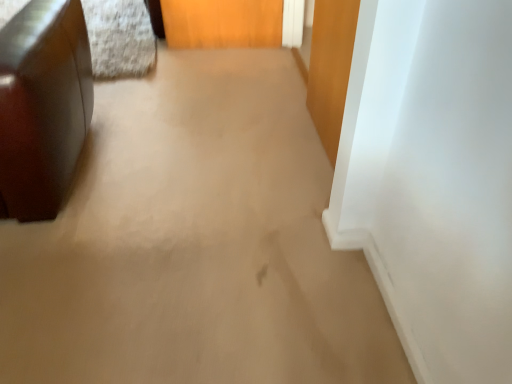
Question: Would you consider glossy brown ottoman at left to be distant from wooden door at upper right?

Choices:
 (A) no
 (B) yes

Answer: (B)

Question: From a real-world perspective, is glossy brown ottoman at left located higher than wooden door at upper right?

Choices:
 (A) yes
 (B) no

Answer: (A)

Question: Is glossy brown ottoman at left positioned in front of wooden door at upper right?

Choices:
 (A) yes
 (B) no

Answer: (A)

Question: Is glossy brown ottoman at left directly adjacent to wooden door at upper right?

Choices:
 (A) yes
 (B) no

Answer: (B)

Question: Does glossy brown ottoman at left turn towards wooden door at upper right?

Choices:
 (A) yes
 (B) no

Answer: (B)

Question: Considering the relative sizes of glossy brown ottoman at left and wooden door at upper right in the image provided, is glossy brown ottoman at left bigger than wooden door at upper right?

Choices:
 (A) yes
 (B) no

Answer: (A)

Question: Does wooden door at upper right have a greater height compared to glossy brown ottoman at left?

Choices:
 (A) yes
 (B) no

Answer: (B)

Question: From a real-world perspective, is wooden door at upper right physically above glossy brown ottoman at left?

Choices:
 (A) yes
 (B) no

Answer: (B)

Question: Does wooden door at upper right contain glossy brown ottoman at left?

Choices:
 (A) yes
 (B) no

Answer: (B)

Question: Is the depth of wooden door at upper right greater than that of glossy brown ottoman at left?

Choices:
 (A) yes
 (B) no

Answer: (A)

Question: From the image's perspective, does wooden door at upper right appear higher than glossy brown ottoman at left?

Choices:
 (A) yes
 (B) no

Answer: (A)

Question: Is wooden door at upper right in front of glossy brown ottoman at left?

Choices:
 (A) yes
 (B) no

Answer: (B)

Question: Is glossy brown ottoman at left to the left or to the right of wooden door at upper right in the image?

Choices:
 (A) left
 (B) right

Answer: (A)